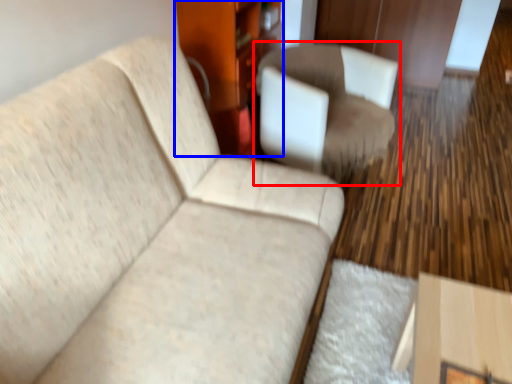
Question: Which point is further to the camera, chair (highlighted by a red box) or dresser (highlighted by a blue box)?

Choices:
 (A) chair
 (B) dresser

Answer: (B)